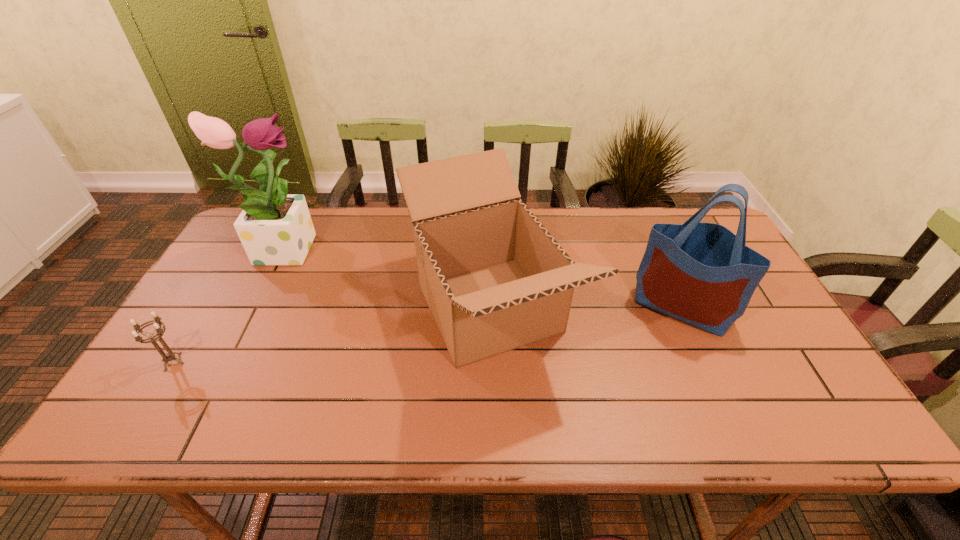
Where is `free spot that satisfies the following two spatial constraints: 1. on the front-facing side of the tallest object; 2. on the left side of the box`? The image size is (960, 540). free spot that satisfies the following two spatial constraints: 1. on the front-facing side of the tallest object; 2. on the left side of the box is located at coordinates (252, 309).

Identify the location of free spot that satisfies the following two spatial constraints: 1. on the front-facing side of the tallest object; 2. on the front side of the candle holder. The width and height of the screenshot is (960, 540). (225, 362).

The image size is (960, 540). I want to click on free spot that satisfies the following two spatial constraints: 1. on the front-facing side of the flower arrangement; 2. on the left side of the box, so click(x=252, y=309).

Where is `vacant space that satisfies the following two spatial constraints: 1. on the back side of the handbag; 2. on the right side of the candle holder`? vacant space that satisfies the following two spatial constraints: 1. on the back side of the handbag; 2. on the right side of the candle holder is located at coordinates (207, 307).

Find the location of a particular element. Image resolution: width=960 pixels, height=540 pixels. free space that satisfies the following two spatial constraints: 1. on the front-facing side of the flower arrangement; 2. on the left side of the rightmost object is located at coordinates (253, 307).

At what (x,y) coordinates should I click in order to perform the action: click on free space that satisfies the following two spatial constraints: 1. on the back side of the handbag; 2. on the right side of the box. Please return your answer as a coordinate pair (x, y). Looking at the image, I should click on (490, 307).